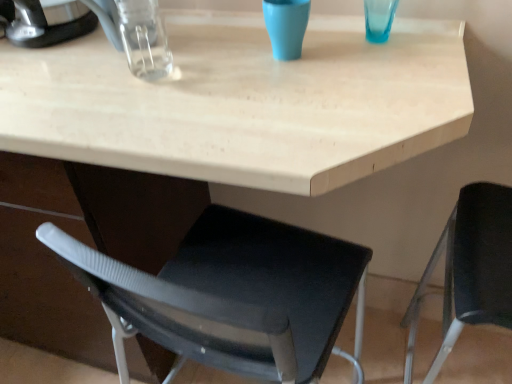
Question: In terms of height, does matte blue cup at upper center look taller or shorter compared to brushed metal coffee maker at upper left?

Choices:
 (A) short
 (B) tall

Answer: (A)

Question: Is matte blue cup at upper center spatially inside brushed metal coffee maker at upper left, or outside of it?

Choices:
 (A) inside
 (B) outside

Answer: (B)

Question: Estimate the real-world distances between objects in this image. Which object is farther from the matte blue cup at upper center?

Choices:
 (A) black plastic chair at right
 (B) brushed metal coffee maker at upper left

Answer: (A)

Question: Estimate the real-world distances between objects in this image. Which object is farther from the brushed metal coffee maker at upper left?

Choices:
 (A) matte blue cup at upper center
 (B) black plastic chair at right

Answer: (B)